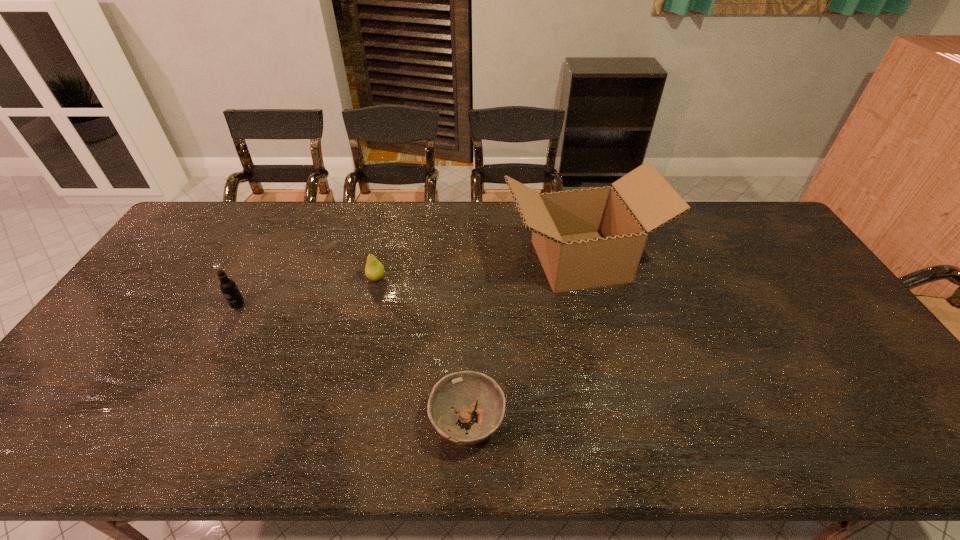
The image size is (960, 540). I want to click on vacant point located between the second object from right to left and the tallest object, so click(x=523, y=342).

Find the location of a particular element. The image size is (960, 540). empty space that is in between the root beer and the box is located at coordinates (409, 283).

In order to click on free spot between the tallest object and the nearest object in this screenshot , I will do `click(523, 342)`.

Identify the location of empty space that is in between the second object from right to left and the box. (523, 342).

Where is `vacant area that lies between the leftmost object and the rightmost object`? The height and width of the screenshot is (540, 960). vacant area that lies between the leftmost object and the rightmost object is located at coordinates (409, 283).

The width and height of the screenshot is (960, 540). Find the location of `vacant region between the second tallest object and the third object from right to left`. vacant region between the second tallest object and the third object from right to left is located at coordinates (307, 292).

The width and height of the screenshot is (960, 540). Identify the location of unoccupied position between the rightmost object and the third object from right to left. click(x=478, y=269).

The image size is (960, 540). I want to click on object that is the closest to the second object from left to right, so click(228, 287).

This screenshot has height=540, width=960. I want to click on object that can be found as the closest to the rightmost object, so click(x=463, y=390).